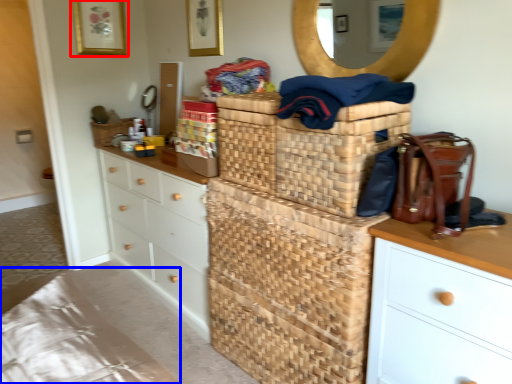
Question: Among these objects, which one is nearest to the camera, picture frame (highlighted by a red box) or bedding (highlighted by a blue box)?

Choices:
 (A) picture frame
 (B) bedding

Answer: (B)